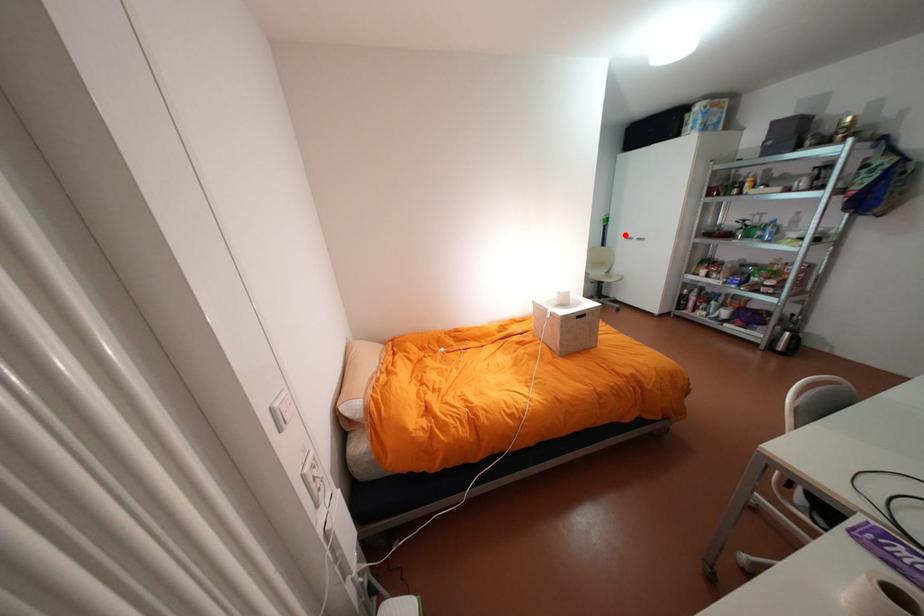
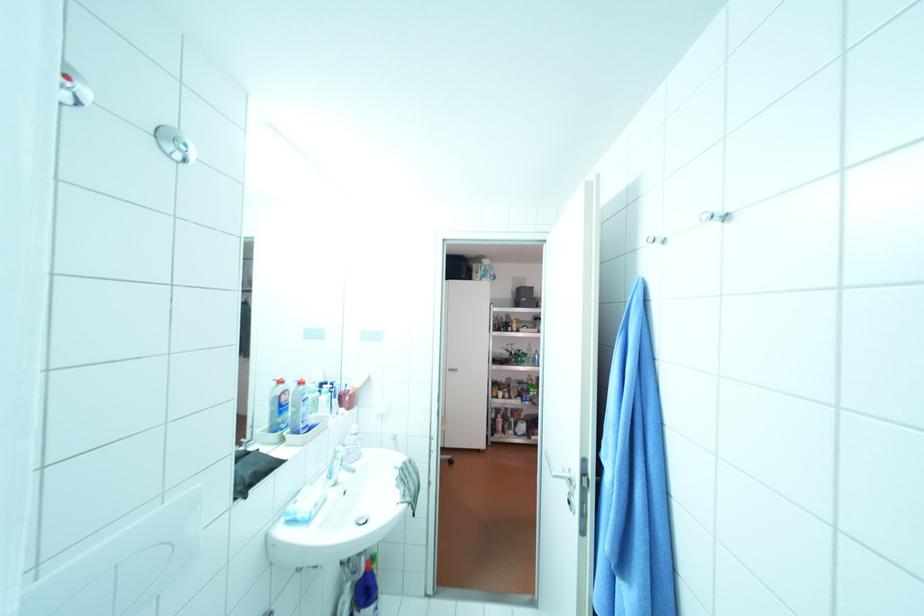
Question: I am providing you with two images of the same scene from different viewpoints. A red point is marked on the first image. At the location where the point appears in image 1, is it still visible in image 2?

Choices:
 (A) Yes
 (B) No

Answer: (B)